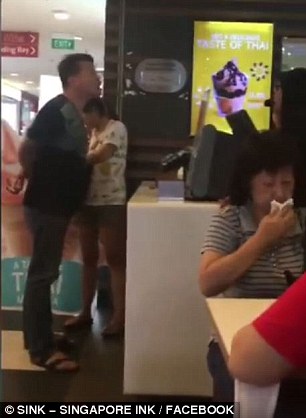
Identify the location of wall. (145, 324).